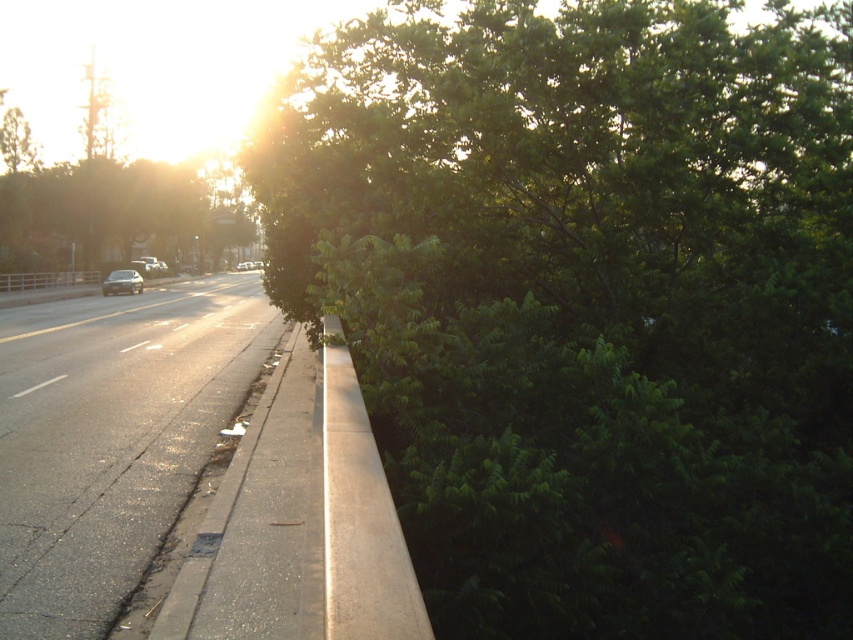
Question: Which of the following is the farthest from the observer?

Choices:
 (A) (166, 326)
 (B) (469, 374)

Answer: (A)

Question: Does green leafy tree at upper right have a lesser width compared to asphalt road at lower left?

Choices:
 (A) yes
 (B) no

Answer: (B)

Question: Which of the following is the closest to the observer?

Choices:
 (A) green leafy tree at upper right
 (B) asphalt road at lower left

Answer: (A)

Question: Is asphalt road at lower left behind satin silver sedan at left?

Choices:
 (A) no
 (B) yes

Answer: (A)

Question: Is asphalt road at lower left wider than concrete at center?

Choices:
 (A) yes
 (B) no

Answer: (A)

Question: Among these points, which one is farthest from the camera?

Choices:
 (A) (361, 515)
 (B) (109, 285)

Answer: (B)